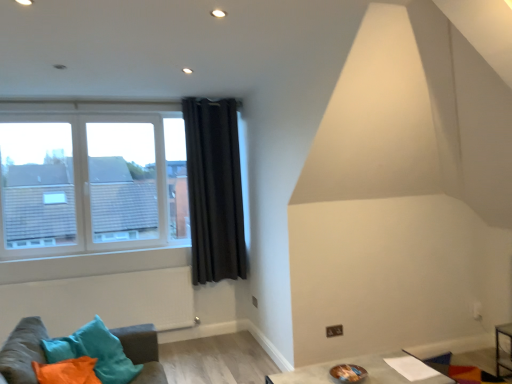
Find the location of a particular element. vacant space underneath clear glass window at left (from a real-world perspective) is located at coordinates (93, 247).